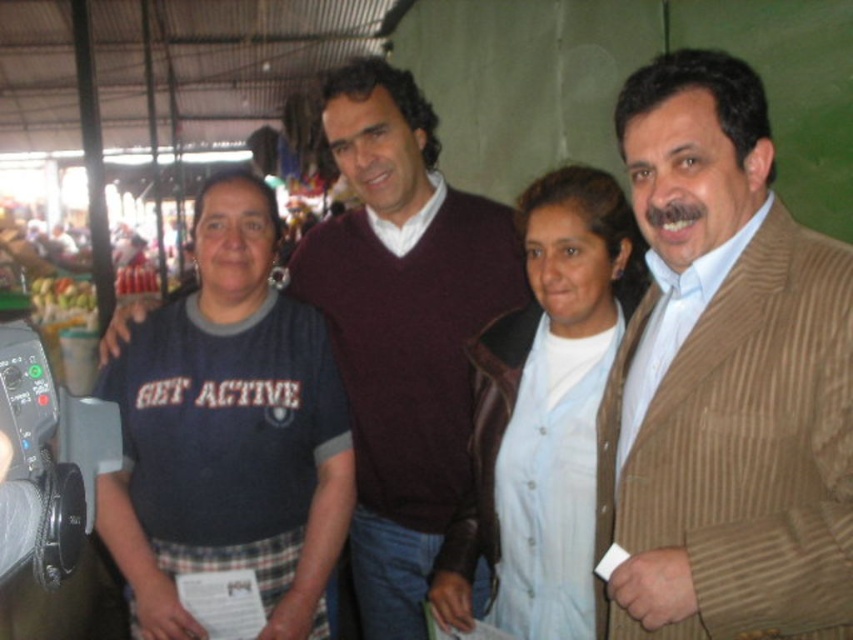
Question: Which is nearer to the maroon sweater at center?

Choices:
 (A) dark blue t-shirt at left
 (B) light blue fabric at center

Answer: (B)

Question: Is the position of dark blue t-shirt at left less distant than that of maroon sweater at center?

Choices:
 (A) yes
 (B) no

Answer: (A)

Question: Which object is positioned closest to the brown corduroy jacket at right?

Choices:
 (A) light blue fabric at center
 (B) dark blue t-shirt at left

Answer: (A)

Question: Estimate the real-world distances between objects in this image. Which object is closer to the maroon sweater at center?

Choices:
 (A) dark blue t-shirt at left
 (B) light blue fabric at center
 (C) brown corduroy jacket at right

Answer: (B)

Question: Is maroon sweater at center positioned before light blue fabric at center?

Choices:
 (A) no
 (B) yes

Answer: (A)

Question: Does dark blue t-shirt at left appear under maroon sweater at center?

Choices:
 (A) no
 (B) yes

Answer: (B)